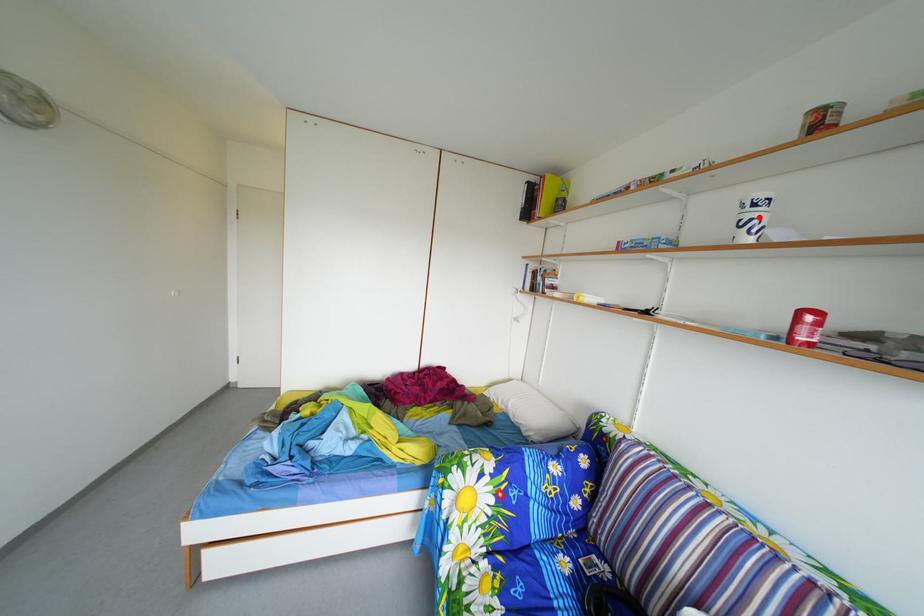
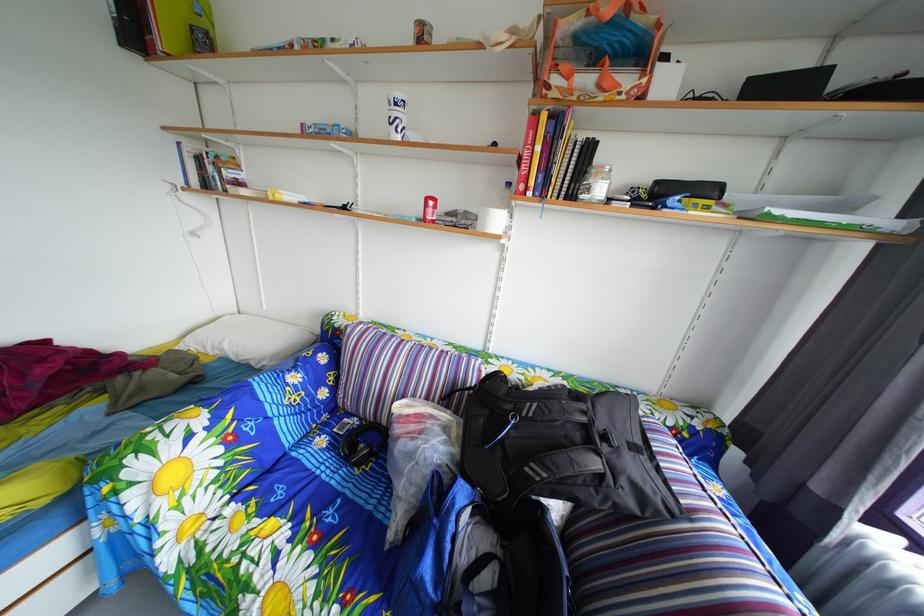
Find the pixel in the second image that matches the highlighted location in the first image.

(404, 116)